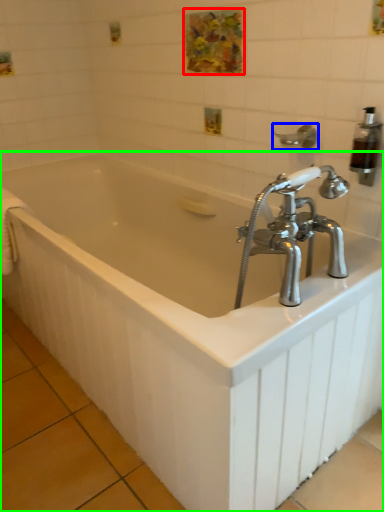
Question: Considering the real-world distances, which object is farthest from art (highlighted by a red box)? shower (highlighted by a blue box) or bathtub (highlighted by a green box)?

Choices:
 (A) shower
 (B) bathtub

Answer: (B)